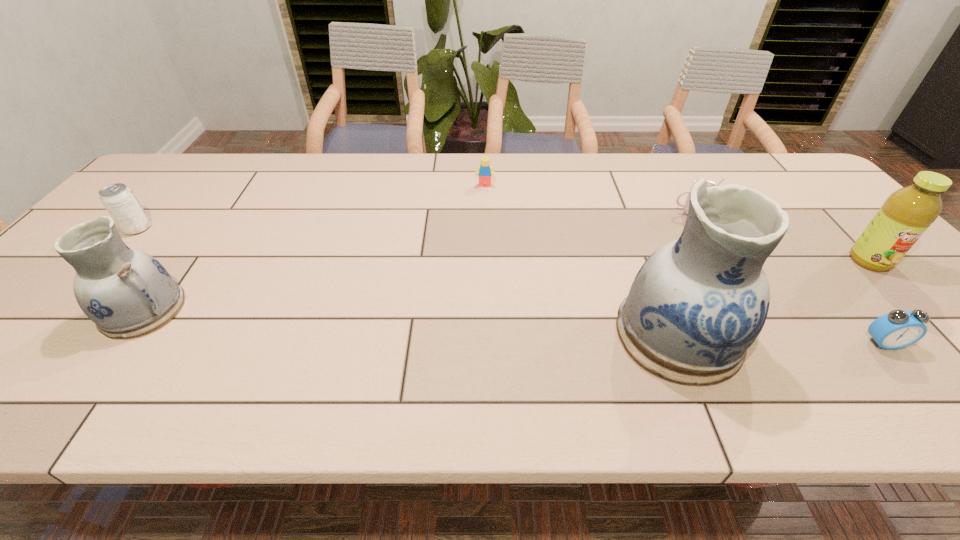
The image size is (960, 540). Identify the location of vacant space that is in between the second object from right to left and the cup. (787, 278).

Find the location of a particular element. The width and height of the screenshot is (960, 540). free space between the Lego and the left pottery is located at coordinates (314, 248).

Where is `free space between the right pottery and the rightmost object`? free space between the right pottery and the rightmost object is located at coordinates (774, 297).

This screenshot has height=540, width=960. In order to click on empty location between the soda can and the cup in this screenshot , I will do `click(414, 221)`.

Where is `vacant region between the cup and the sixth object from right to left`? Image resolution: width=960 pixels, height=540 pixels. vacant region between the cup and the sixth object from right to left is located at coordinates (418, 261).

Image resolution: width=960 pixels, height=540 pixels. What are the coordinates of `vacant area between the left pottery and the right pottery` in the screenshot? It's located at (411, 322).

Locate an element on the screen. empty space between the sixth object from left to right and the cup is located at coordinates (787, 278).

Identify the location of unoccupied position between the cup and the second object from right to left. (787, 278).

Where is `vacant space in between the tallest object and the fruit juice`? The width and height of the screenshot is (960, 540). vacant space in between the tallest object and the fruit juice is located at coordinates (774, 297).

Select which object appears as the third closest to the soda can. Please provide its 2D coordinates. Your answer should be formatted as a tuple, i.e. [(x, y)], where the tuple contains the x and y coordinates of a point satisfying the conditions above.

[(696, 305)]